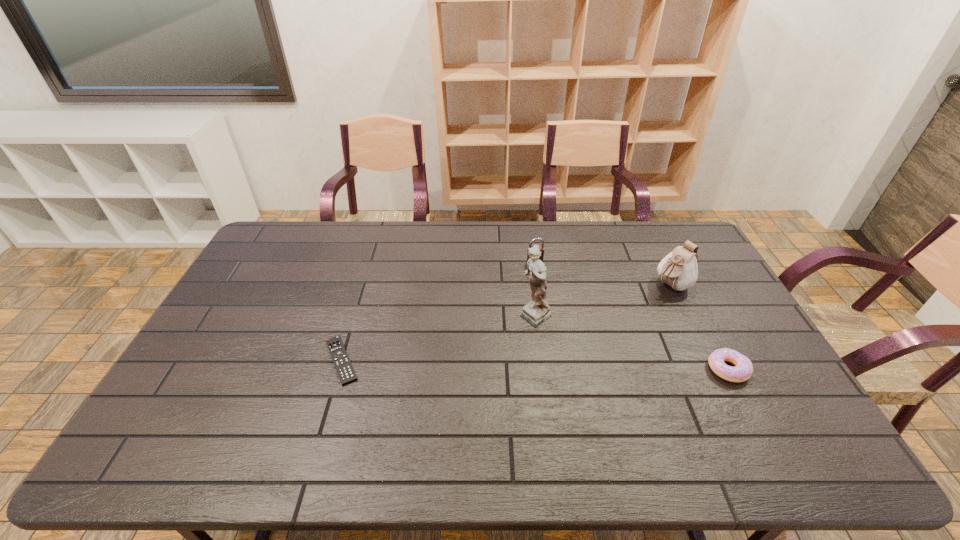
Where is `vacant space situated 0.080m on the front of the fourth tallest object`? This screenshot has width=960, height=540. vacant space situated 0.080m on the front of the fourth tallest object is located at coordinates pyautogui.click(x=750, y=411).

I want to click on free spot located on the front-facing side of the third shortest object, so click(579, 346).

This screenshot has width=960, height=540. I want to click on free space located on the front-facing side of the third shortest object, so click(545, 282).

I want to click on blank space located on the front-facing side of the third shortest object, so click(564, 317).

Locate an element on the screen. The width and height of the screenshot is (960, 540). vacant area located 0.190m on the front-facing side of the figurine is located at coordinates (482, 363).

The image size is (960, 540). Identify the location of vacant area situated 0.200m on the front-facing side of the figurine. (479, 365).

You are a GUI agent. You are given a task and a screenshot of the screen. Output one action in this format:
    pyautogui.click(x=<x>, y=<y>)
    Task: Click on the vacant region located on the front-facing side of the figurine
    The image size is (960, 540).
    Given the screenshot: What is the action you would take?
    pyautogui.click(x=453, y=386)

You are a GUI agent. You are given a task and a screenshot of the screen. Output one action in this format:
    pyautogui.click(x=<x>, y=<y>)
    Task: Click on the free spot located 0.320m on the front-facing side of the pouch
    Image resolution: width=960 pixels, height=540 pixels.
    Given the screenshot: What is the action you would take?
    pyautogui.click(x=592, y=338)

Where is `vacant region located on the front-facing side of the pouch`? vacant region located on the front-facing side of the pouch is located at coordinates (645, 300).

Where is `free spot located on the front-facing side of the pouch`? This screenshot has height=540, width=960. free spot located on the front-facing side of the pouch is located at coordinates (628, 312).